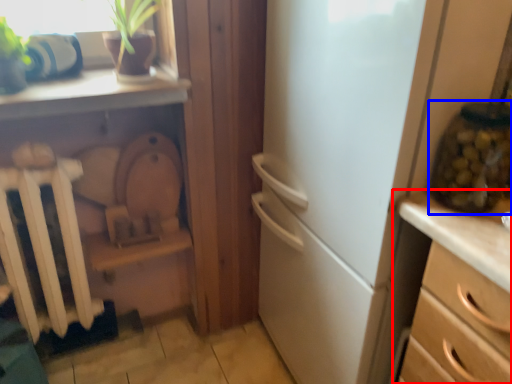
Question: Which of the following is the closest to the observer, chest of drawers (highlighted by a red box) or glass jar (highlighted by a blue box)?

Choices:
 (A) chest of drawers
 (B) glass jar

Answer: (A)